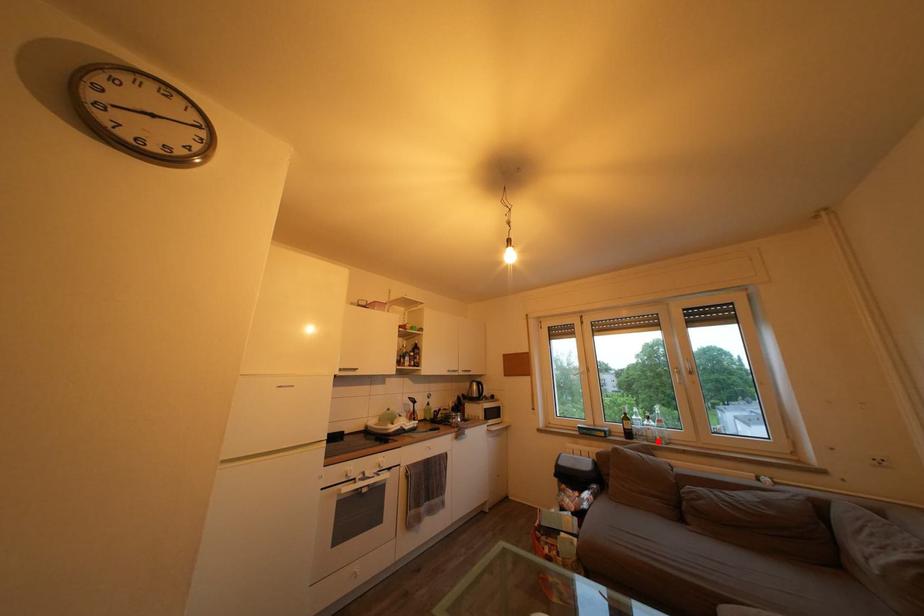
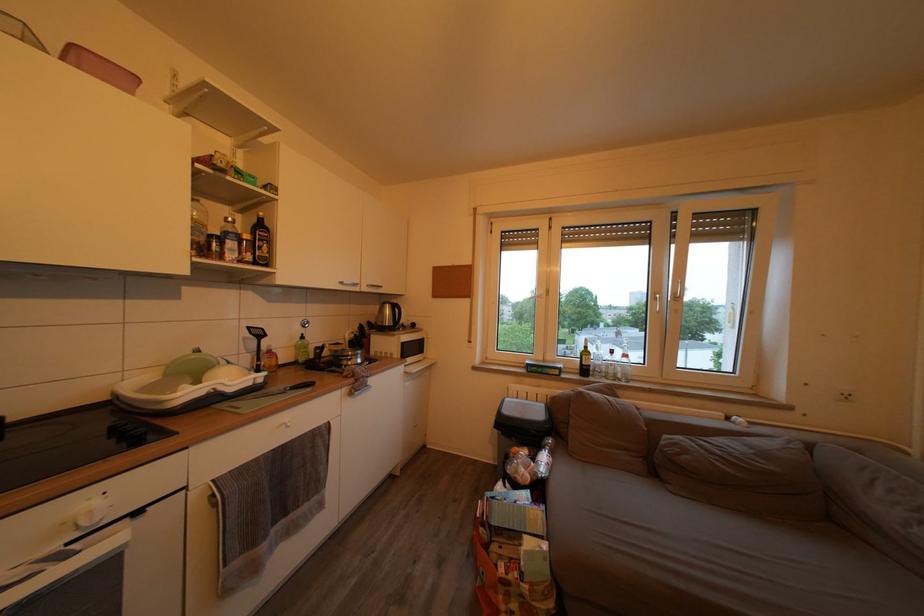
The point at the highlighted location is marked in the first image. Where is the corresponding point in the second image?

(618, 378)